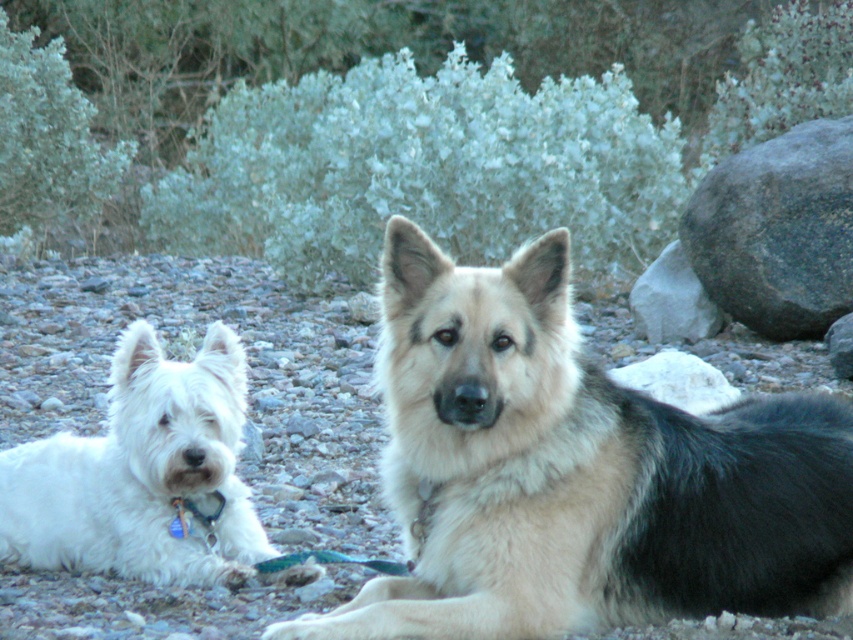
Question: Which of these objects is positioned closest to the gray rock at right?

Choices:
 (A) white fluffy dog at left
 (B) gray rough rock at right
 (C) light brown fur at center

Answer: (B)

Question: Based on their relative distances, which object is farther from the gray rock at right?

Choices:
 (A) gray rough rock at right
 (B) light brown fur at center
 (C) white fluffy dog at left

Answer: (B)

Question: Can you confirm if white fluffy dog at left is bigger than gray rock at right?

Choices:
 (A) no
 (B) yes

Answer: (B)

Question: Is light brown fur at center above gray rough rock at right?

Choices:
 (A) no
 (B) yes

Answer: (A)

Question: Which point is farther to the camera?

Choices:
 (A) (769, 147)
 (B) (665, 268)
 (C) (213, 554)

Answer: (B)

Question: Does gray rough rock at right have a larger size compared to gray rock at right?

Choices:
 (A) no
 (B) yes

Answer: (B)